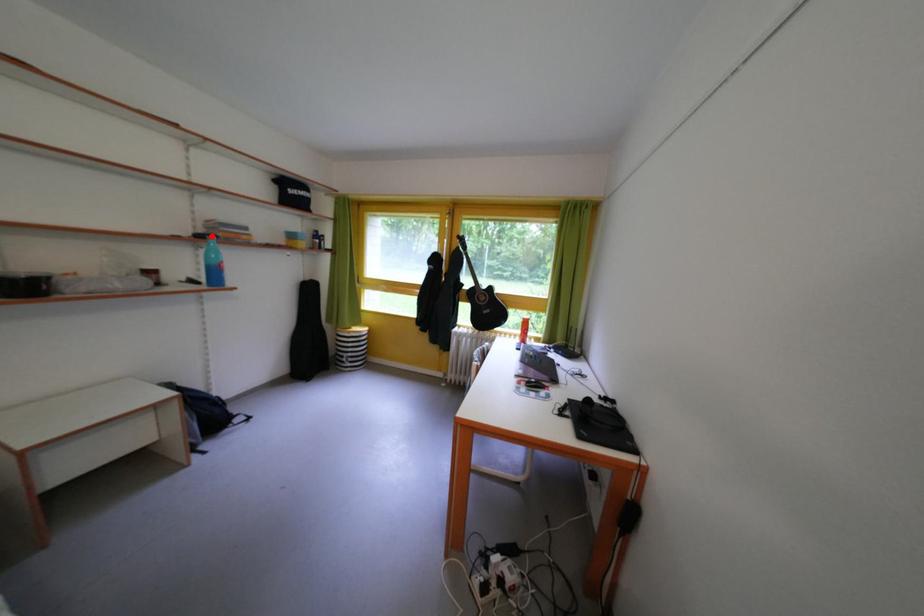
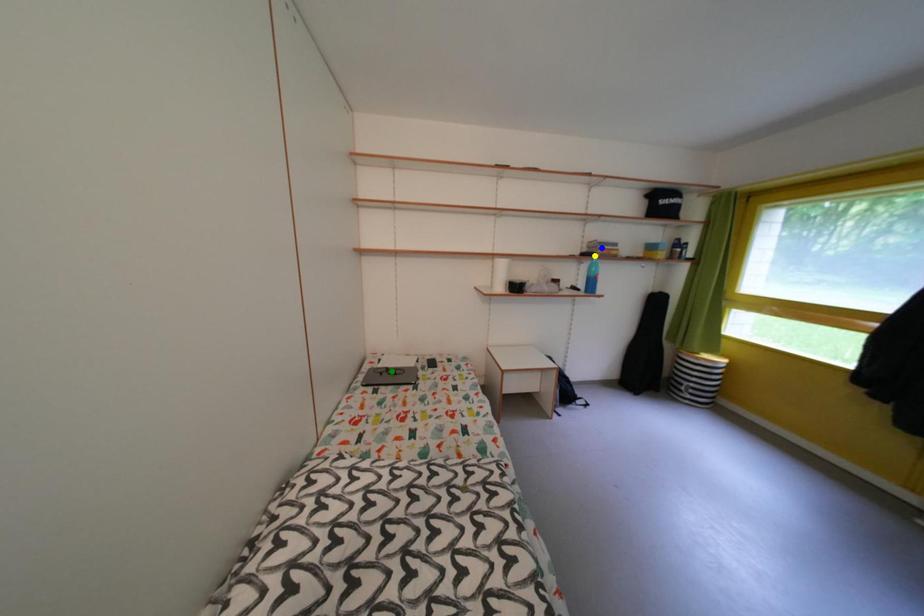
Question: I am providing you with two images of the same scene from different viewpoints. A red point is marked on the first image. You are given multiple points on the second image. Which spot in image 2 lines up with the point in image 1?

Choices:
 (A) yellow point
 (B) green point
 (C) blue point

Answer: (A)